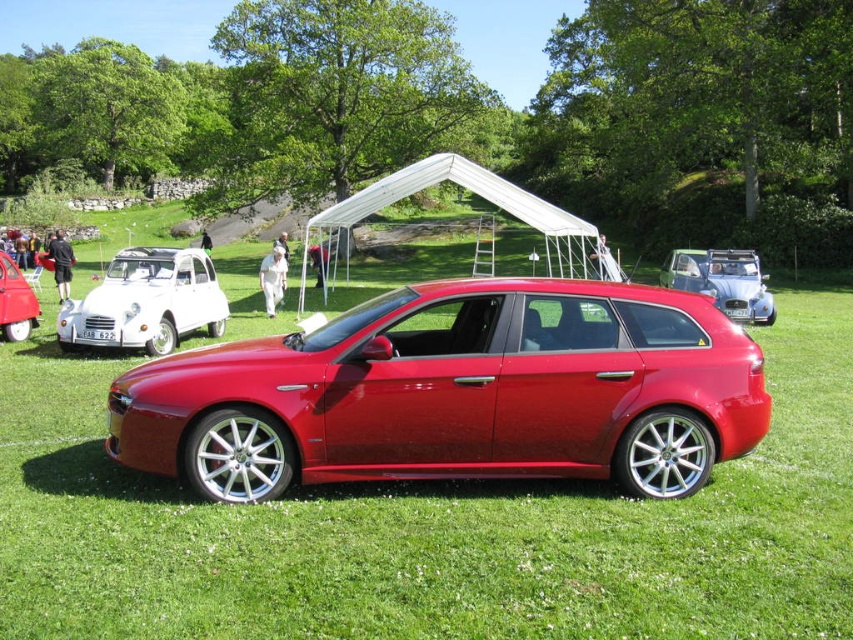
Which is behind, point (624, 314) or point (704, 275)?

Positioned behind is point (704, 275).

Describe the element at coordinates (456, 392) in the screenshot. This screenshot has height=640, width=853. I see `glossy metallic car at center` at that location.

Where is `glossy metallic car at center`? glossy metallic car at center is located at coordinates (456, 392).

Does glossy red car at center have a lesser width compared to metallic silver car at left?

No.

Measure the distance between glossy red car at center and camera.

glossy red car at center and camera are 12.00 feet apart.

At what (x,y) coordinates should I click in order to perform the action: click on glossy red car at center. Please return your answer as a coordinate pair (x, y). Looking at the image, I should click on (431, 529).

Measure the distance between white lace dress at upper center and light brown leather jacket at center.

white lace dress at upper center and light brown leather jacket at center are 9.66 meters apart from each other.

Can you confirm if white lace dress at upper center is thinner than light brown leather jacket at center?

In fact, white lace dress at upper center might be wider than light brown leather jacket at center.

Identify the location of white lace dress at upper center. The height and width of the screenshot is (640, 853). (605, 260).